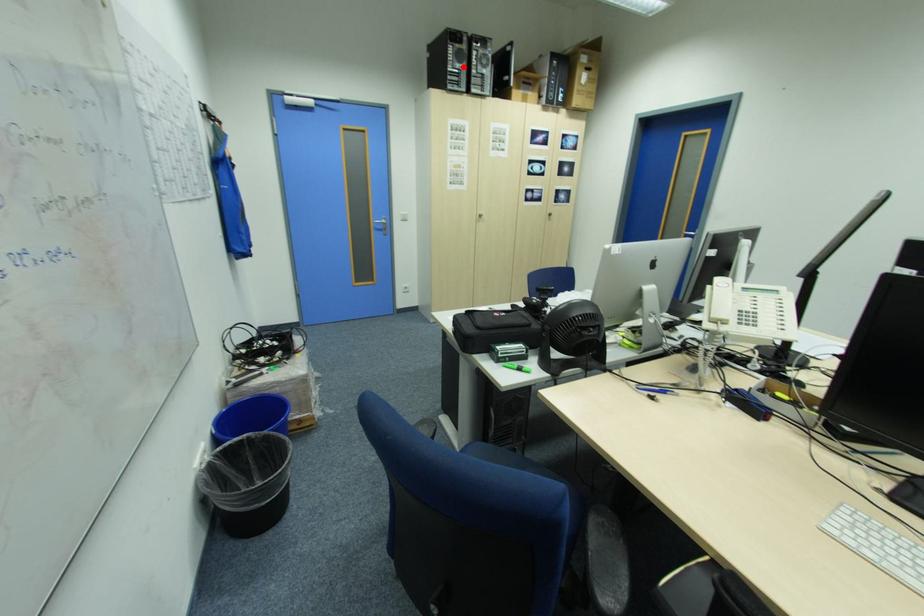
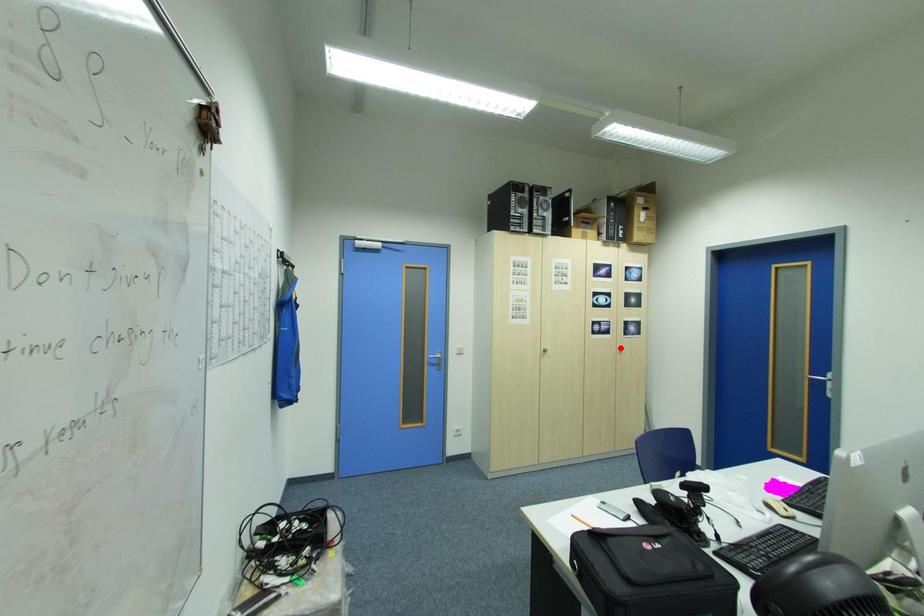
I am providing you with two images of the same scene from different viewpoints. A red point is marked on the first image and another point is marked on the second image. Are the points marked in image1 and image2 representing the same 3D position?

No